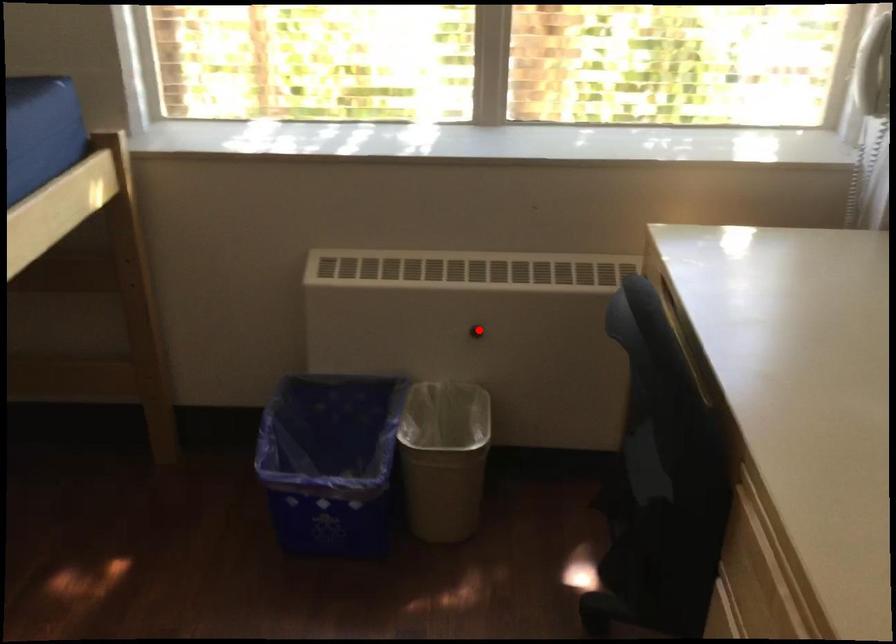
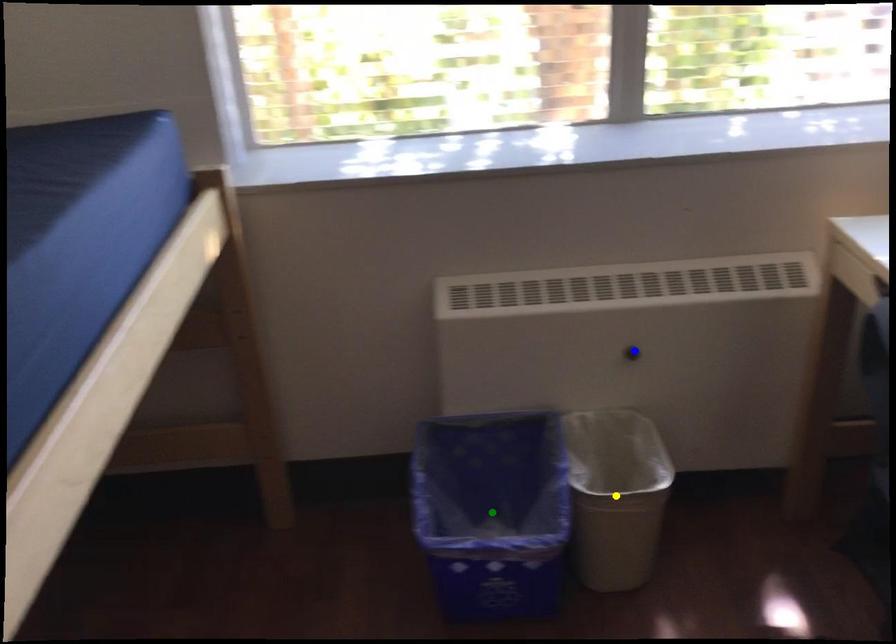
Question: I am providing you with two images of the same scene from different viewpoints. A red point is marked on the first image. You are given multiple points on the second image. Can you choose the point in image 2 that corresponds to the point in image 1?

Choices:
 (A) blue point
 (B) yellow point
 (C) green point

Answer: (A)